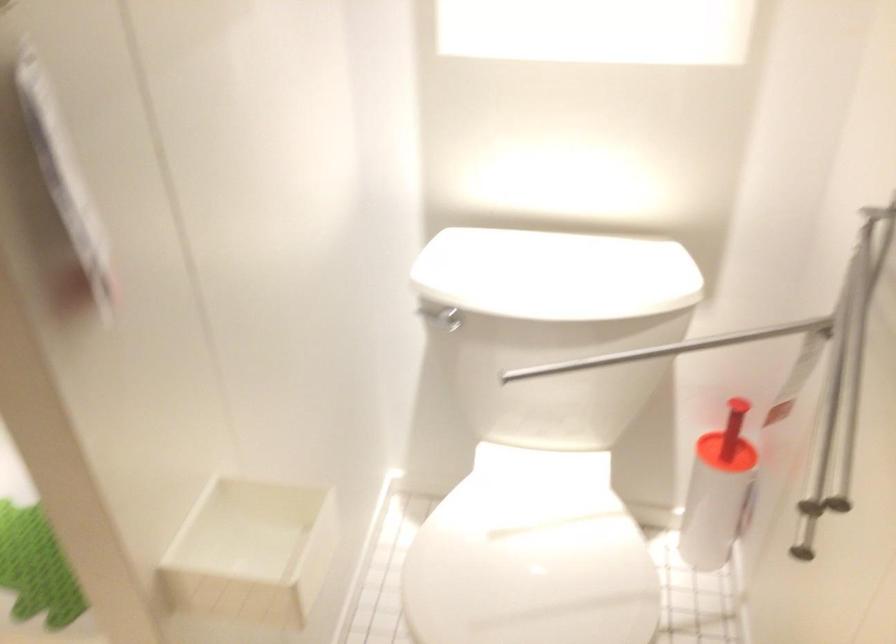
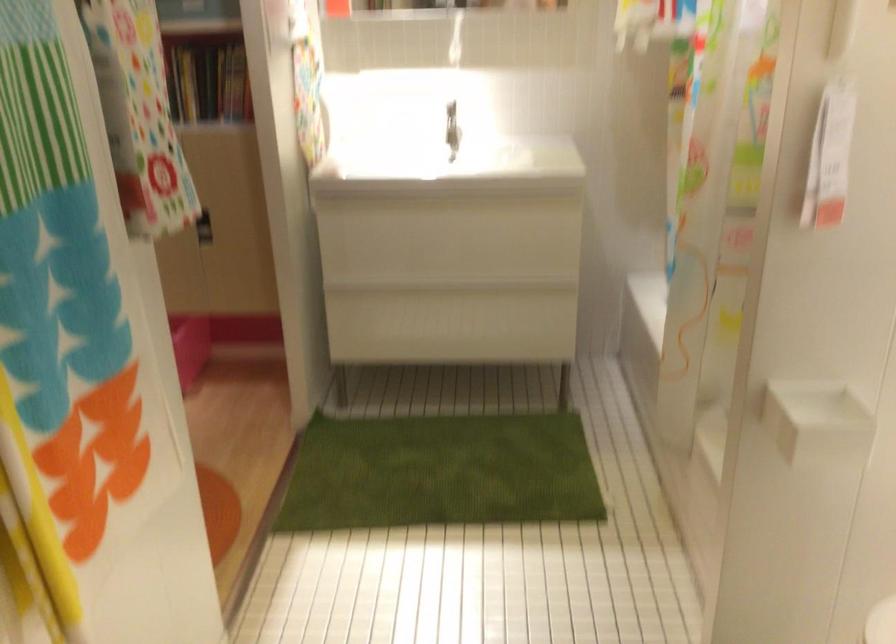
First-person continuous shooting, in which direction is the camera rotating?

The camera rotated toward left-down.